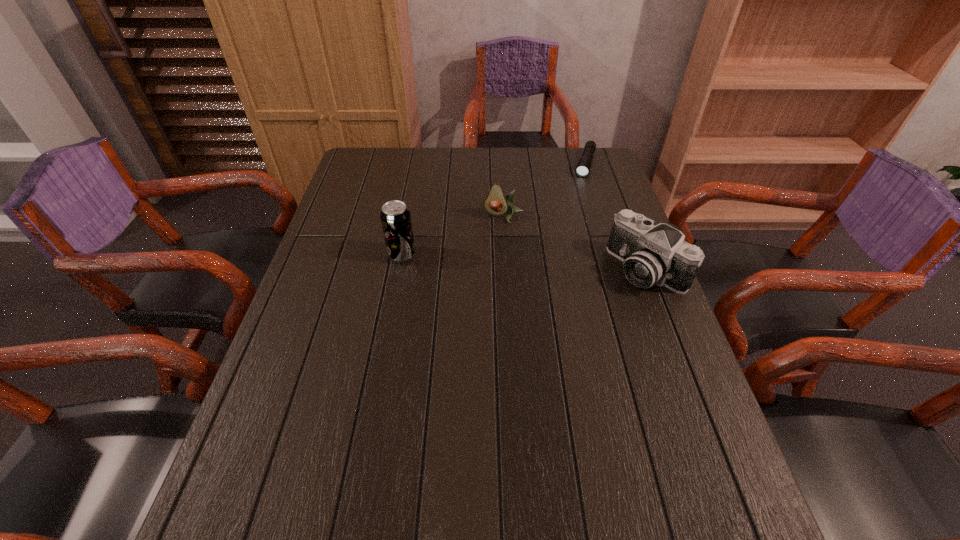
Image resolution: width=960 pixels, height=540 pixels. What are the coordinates of `soda can` in the screenshot? It's located at (395, 217).

Identify the location of camera. (651, 254).

What are the coordinates of `flashlight` in the screenshot? It's located at coord(583,167).

Find the location of a particular element. the shortest object is located at coordinates (583, 167).

Identify the location of the second farthest object. The image size is (960, 540). (496, 203).

Locate an element on the screen. The height and width of the screenshot is (540, 960). avocado is located at coordinates (496, 203).

The width and height of the screenshot is (960, 540). In order to click on free space located on the front of the leftmost object in this screenshot , I will do `click(395, 291)`.

This screenshot has width=960, height=540. In order to click on free space located 0.220m on the back of the camera in this screenshot , I will do `click(620, 200)`.

Locate an element on the screen. blank space located 0.160m at the lens end of the flashlight is located at coordinates (577, 204).

Find the location of `free space located at the lens end of the flashlight`. free space located at the lens end of the flashlight is located at coordinates (568, 230).